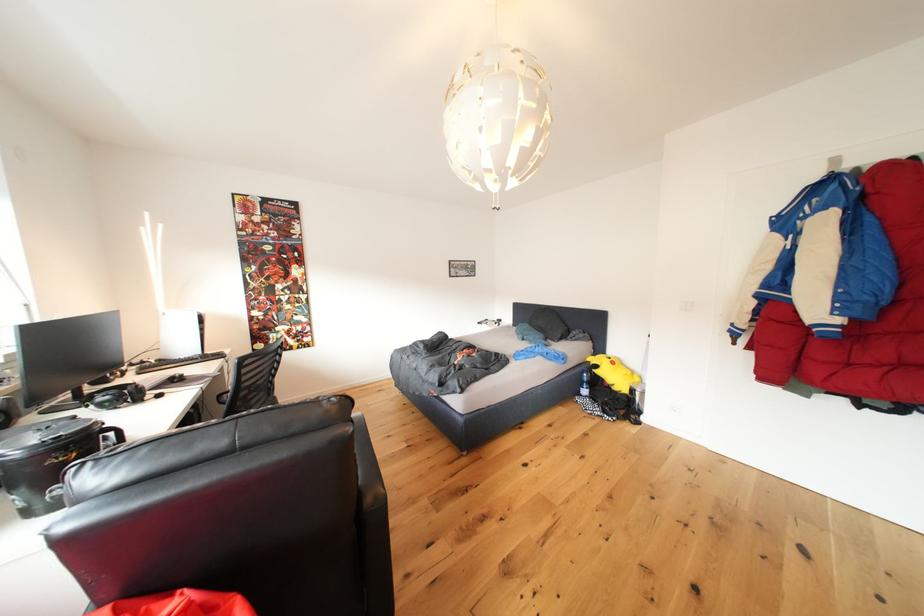
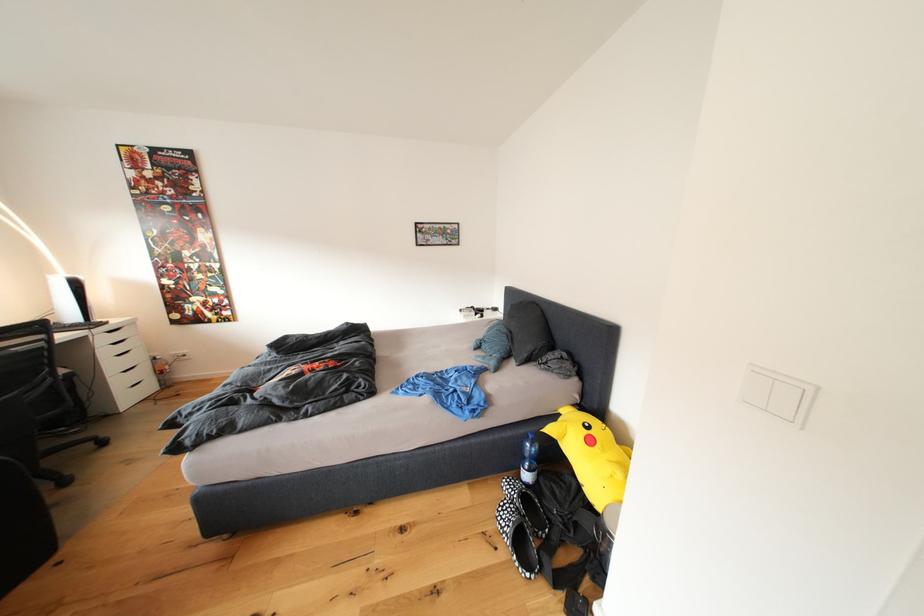
In the second image, find the point that corresponds to pixel 591 381 in the first image.

(531, 451)